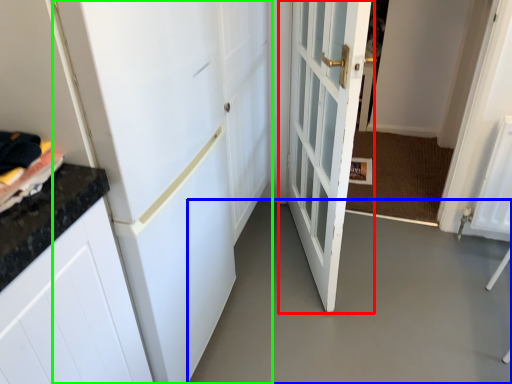
Question: Which is farther away from door (highlighted by a red box)? concrete (highlighted by a blue box) or door (highlighted by a green box)?

Choices:
 (A) concrete
 (B) door

Answer: (A)